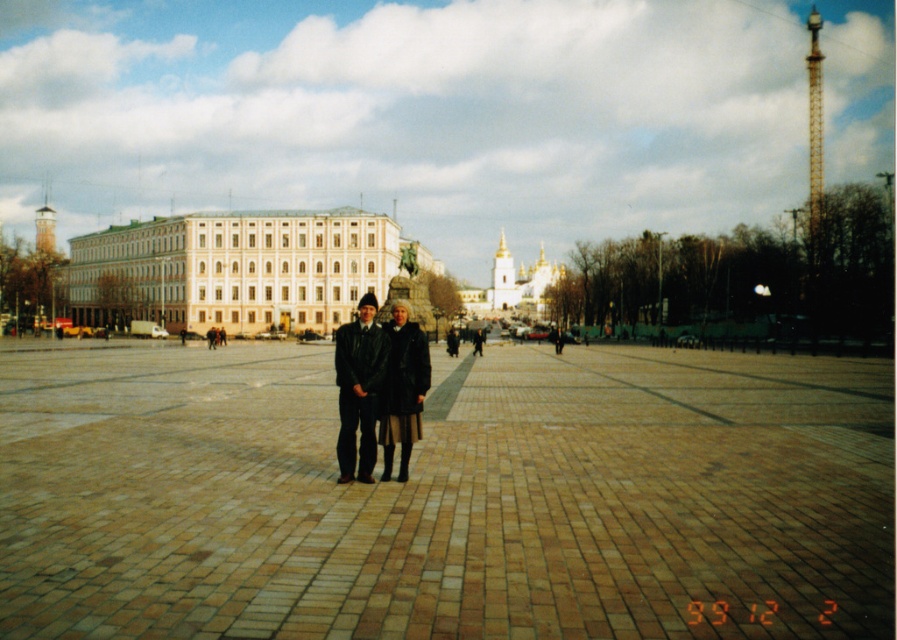
Looking at this image, how far apart are white smooth building at center and golden domed church at center?

white smooth building at center is 44.78 meters away from golden domed church at center.

Measure the distance between point (138, 264) and camera.

Point (138, 264) is 486.27 feet from camera.

This screenshot has width=897, height=640. Identify the location of white smooth building at center. (236, 269).

Is white smooth building at center below leather jacket at center?

Actually, white smooth building at center is above leather jacket at center.

Who is higher up, white smooth building at center or leather jacket at center?

Positioned higher is white smooth building at center.

Between point (159, 237) and point (376, 369), which one is positioned behind?

Point (159, 237)

The image size is (897, 640). I want to click on white smooth building at center, so click(x=236, y=269).

Can you confirm if leather jacket at center is positioned to the left of golden domed church at center?

Correct, you'll find leather jacket at center to the left of golden domed church at center.

Is the position of leather jacket at center less distant than that of golden domed church at center?

Yes, leather jacket at center is closer to the viewer.

This screenshot has width=897, height=640. What do you see at coordinates (379, 385) in the screenshot?
I see `leather jacket at center` at bounding box center [379, 385].

Where is `leather jacket at center`? leather jacket at center is located at coordinates (379, 385).